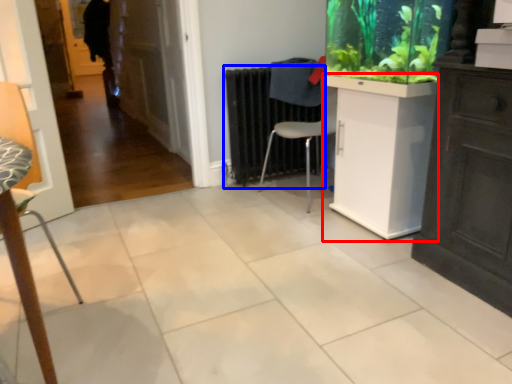
Question: Which object is further to the camera taking this photo, counter (highlighted by a red box) or radiator (highlighted by a blue box)?

Choices:
 (A) counter
 (B) radiator

Answer: (B)